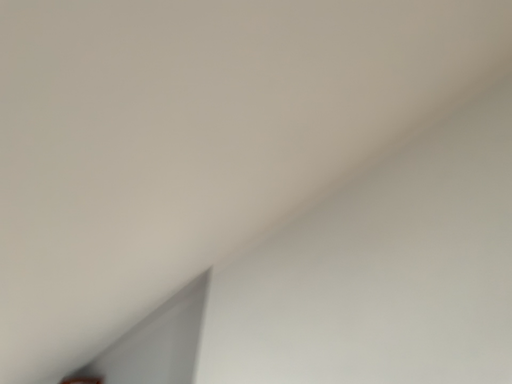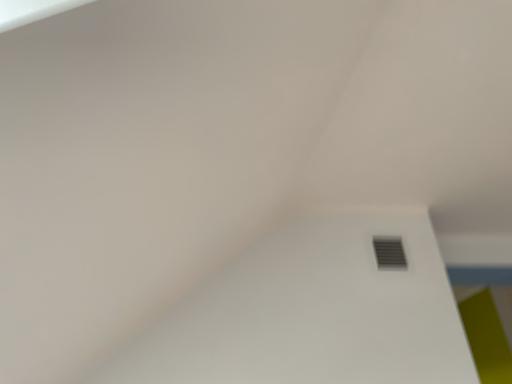
Question: How did the camera likely rotate when shooting the video?

Choices:
 (A) rotated right
 (B) rotated left

Answer: (A)